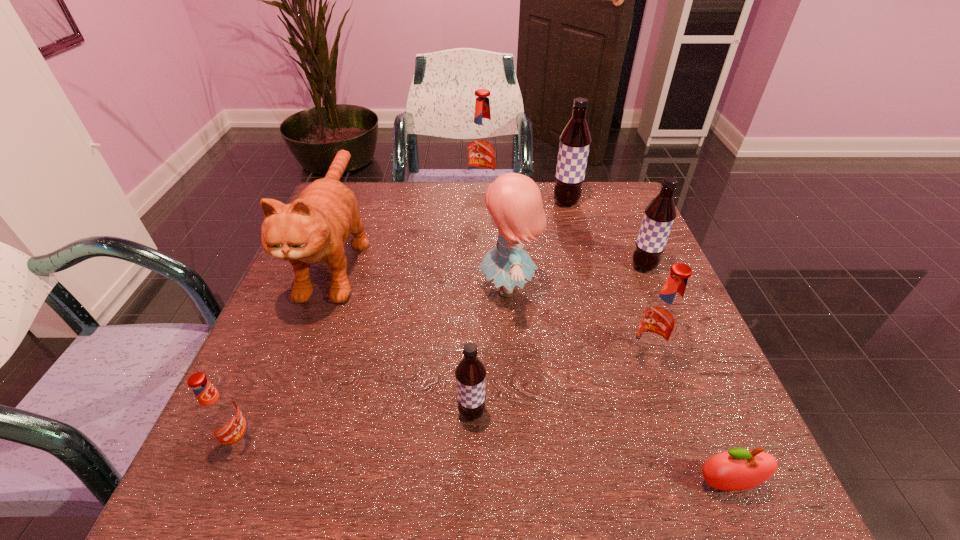
The image size is (960, 540). In order to click on the farthest red root beer in this screenshot , I will do `click(482, 147)`.

Locate an element on the screen. This screenshot has width=960, height=540. the biggest red root beer is located at coordinates (482, 147).

Where is `the second brown root beer from left to right`? This screenshot has height=540, width=960. the second brown root beer from left to right is located at coordinates (575, 140).

Identify the location of the farthest brown root beer. (575, 140).

Find the location of `doll`. doll is located at coordinates (514, 201).

I want to click on cat, so click(x=316, y=226).

You are a GUI agent. You are given a task and a screenshot of the screen. Output one action in this format:
    pyautogui.click(x=<x>, y=<y>)
    Task: Click on the rightmost root beer
    
    Given the screenshot: What is the action you would take?
    pyautogui.click(x=659, y=215)

You are a GUI agent. You are given a task and a screenshot of the screen. Output one action in this format:
    pyautogui.click(x=<x>, y=<y>)
    Task: Click on the third farthest root beer
    The image size is (960, 540).
    Given the screenshot: What is the action you would take?
    pyautogui.click(x=659, y=215)

Where is `the rightmost red root beer`? The height and width of the screenshot is (540, 960). the rightmost red root beer is located at coordinates (662, 319).

This screenshot has height=540, width=960. In order to click on the second smallest red root beer in this screenshot , I will do `click(662, 319)`.